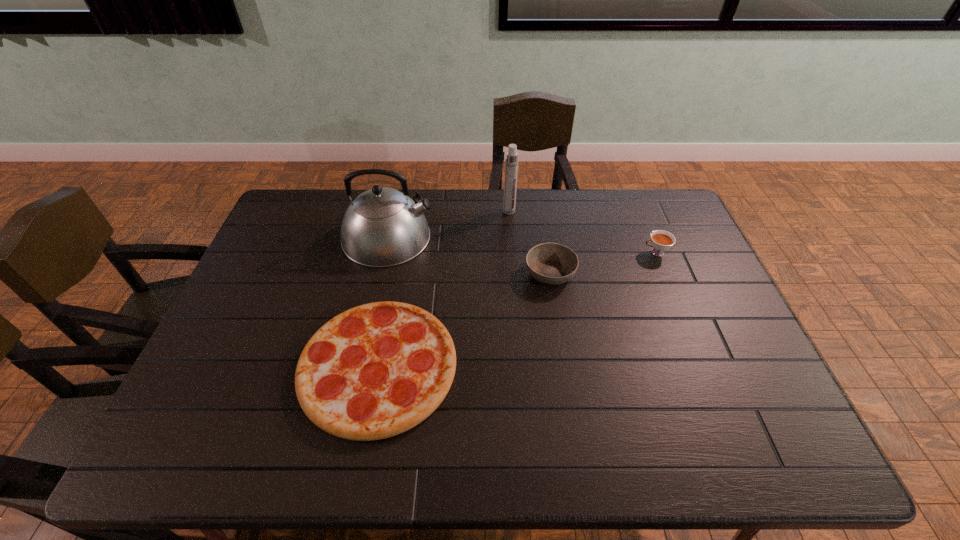
You are a GUI agent. You are given a task and a screenshot of the screen. Output one action in this format:
    pyautogui.click(x=<x>, y=<y>)
    Task: Click on the free space located 0.180m on the side of the teacup with the handle
    The width and height of the screenshot is (960, 540).
    Given the screenshot: What is the action you would take?
    pyautogui.click(x=587, y=253)

Locate an element on the screen. The height and width of the screenshot is (540, 960). vacant space located 0.250m on the front of the second object from right to left is located at coordinates (564, 364).

Where is `free location located on the right of the shortest object`? Image resolution: width=960 pixels, height=540 pixels. free location located on the right of the shortest object is located at coordinates (503, 367).

At what (x,y) coordinates should I click in order to perform the action: click on kettle that is positioned at the far edge. Please return your answer as a coordinate pair (x, y). This screenshot has height=540, width=960. Looking at the image, I should click on (383, 227).

I want to click on aerosol can present at the far edge, so click(x=511, y=162).

Where is `object that is at the near edge`? The width and height of the screenshot is (960, 540). object that is at the near edge is located at coordinates (374, 371).

At what (x,y) coordinates should I click in order to perform the action: click on object that is at the right edge. Please return your answer as a coordinate pair (x, y). This screenshot has height=540, width=960. Looking at the image, I should click on (661, 240).

In the image, there is a desktop. Where is `vacant space at the far edge`? vacant space at the far edge is located at coordinates (562, 204).

The image size is (960, 540). I want to click on vacant region at the near edge of the desktop, so click(700, 434).

Where is `free space at the left edge of the desktop`? Image resolution: width=960 pixels, height=540 pixels. free space at the left edge of the desktop is located at coordinates (285, 260).